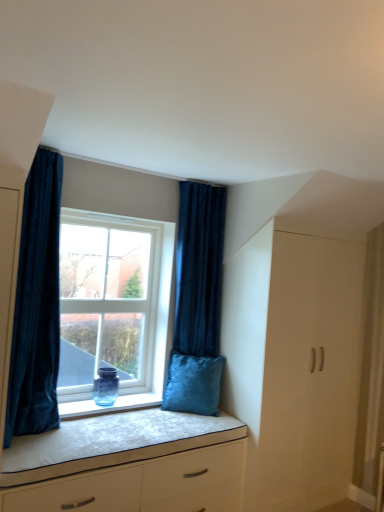
Question: From a real-world perspective, is velvet blue pillow at window over velvet dark blue curtain at left, which ranks as the 1th curtain in front-to-back order?

Choices:
 (A) no
 (B) yes

Answer: (A)

Question: Does velvet blue pillow at window have a lesser height compared to velvet dark blue curtain at left, which is the first curtain from left to right?

Choices:
 (A) yes
 (B) no

Answer: (A)

Question: Is velvet blue pillow at window at the right side of velvet dark blue curtain at left, which is the second curtain in back-to-front order?

Choices:
 (A) no
 (B) yes

Answer: (B)

Question: Considering the relative sizes of velvet blue pillow at window and velvet dark blue curtain at left, which ranks as the 1th curtain in front-to-back order, in the image provided, is velvet blue pillow at window wider than velvet dark blue curtain at left, which ranks as the 1th curtain in front-to-back order,?

Choices:
 (A) yes
 (B) no

Answer: (B)

Question: Does velvet blue pillow at window have a smaller size compared to velvet dark blue curtain at left, which is the second curtain in back-to-front order?

Choices:
 (A) yes
 (B) no

Answer: (A)

Question: Is velvet blue pillow at window not within velvet dark blue curtain at left, the 2th curtain viewed from the right?

Choices:
 (A) no
 (B) yes

Answer: (B)

Question: Is transparent glass window at center inside velvet dark blue curtain at right, the first curtain in the back-to-front sequence?

Choices:
 (A) no
 (B) yes

Answer: (A)

Question: Considering the relative positions of velvet dark blue curtain at right, which is the 2th curtain from left to right, and transparent glass window at center in the image provided, is velvet dark blue curtain at right, which is the 2th curtain from left to right, to the right of transparent glass window at center from the viewer's perspective?

Choices:
 (A) no
 (B) yes

Answer: (B)

Question: Could you tell me if velvet dark blue curtain at right, the first curtain in the back-to-front sequence, is facing transparent glass window at center?

Choices:
 (A) no
 (B) yes

Answer: (A)

Question: From the image's perspective, is velvet dark blue curtain at right, which ranks as the 2th curtain in front-to-back order, over transparent glass window at center?

Choices:
 (A) no
 (B) yes

Answer: (B)

Question: From a real-world perspective, is velvet dark blue curtain at right, which is the 2th curtain from left to right, physically below transparent glass window at center?

Choices:
 (A) no
 (B) yes

Answer: (A)

Question: Considering the relative sizes of velvet dark blue curtain at right, the first curtain in the back-to-front sequence, and transparent glass window at center in the image provided, is velvet dark blue curtain at right, the first curtain in the back-to-front sequence, bigger than transparent glass window at center?

Choices:
 (A) no
 (B) yes

Answer: (B)

Question: Is velvet dark blue curtain at right, the first curtain in the back-to-front sequence, oriented away from white matte chest of drawers at lower center?

Choices:
 (A) no
 (B) yes

Answer: (A)